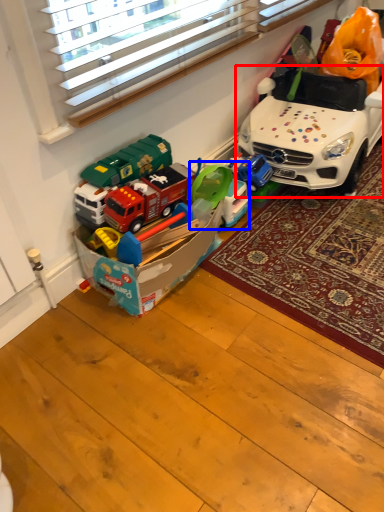
Question: Which of the following is the closest to the observer, car (highlighted by a red box) or toy (highlighted by a blue box)?

Choices:
 (A) car
 (B) toy

Answer: (A)